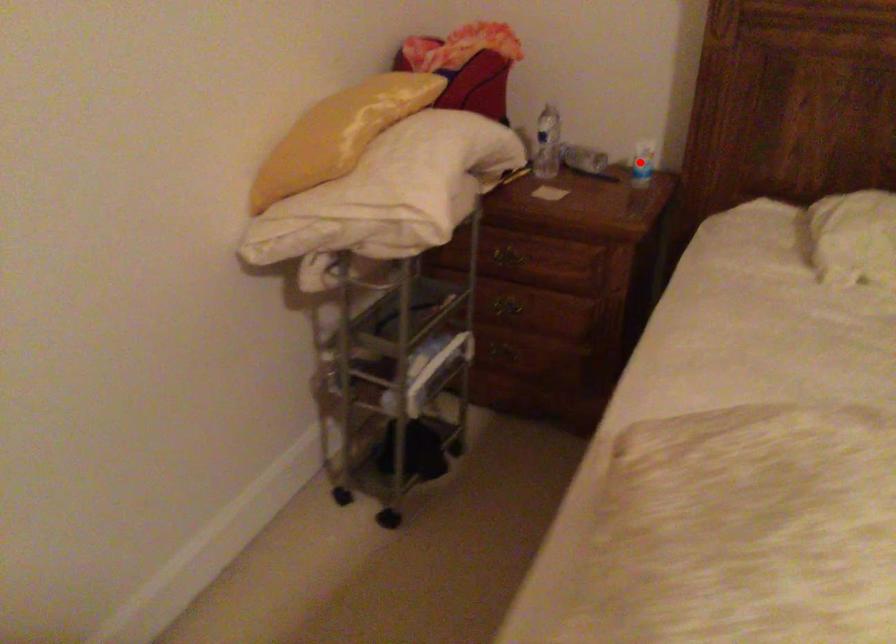
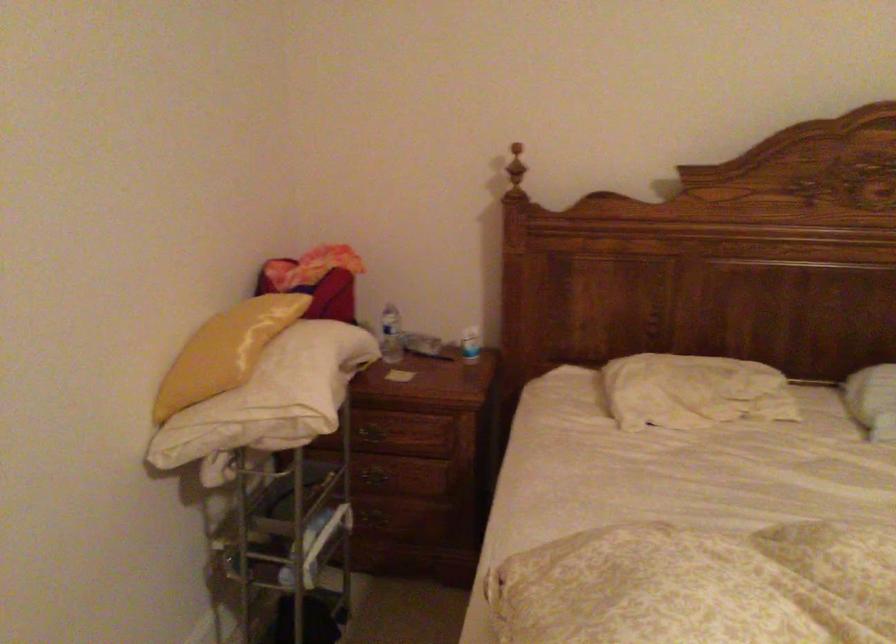
Question: I am providing you with two images of the same scene from different viewpoints. Image1 has a red point marked. In image2, the corresponding 3D location appears at what relative position? Reply with the corresponding letter.

Choices:
 (A) Closer
 (B) Farther

Answer: (B)